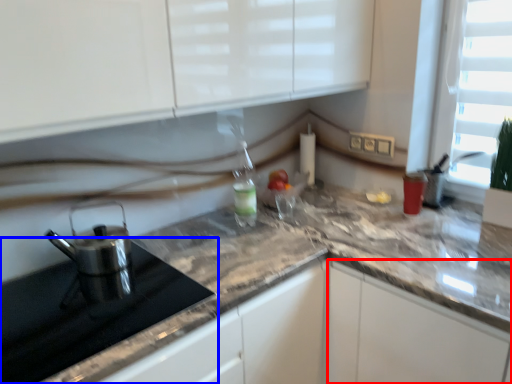
Question: Which object is further to the camera taking this photo, cabinetry (highlighted by a red box) or appliance (highlighted by a blue box)?

Choices:
 (A) cabinetry
 (B) appliance

Answer: (A)